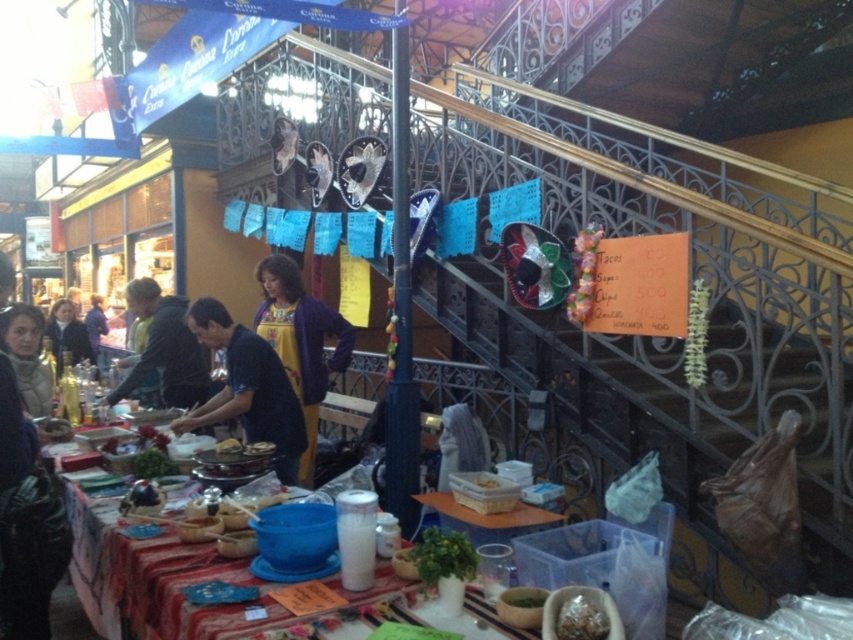
Measure the distance between purple knitwear at center and dark blue sweater at left.

purple knitwear at center and dark blue sweater at left are 14.21 feet apart.

Is purple knitwear at center closer to the viewer compared to dark blue sweater at left?

Yes, purple knitwear at center is in front of dark blue sweater at left.

Who is more distant from viewer, (x=302, y=305) or (x=67, y=348)?

Point (x=67, y=348)

I want to click on purple knitwear at center, so (x=300, y=340).

What do you see at coordinates (67, 333) in the screenshot? The height and width of the screenshot is (640, 853). I see `dark blue sweater at left` at bounding box center [67, 333].

Is point (76, 324) closer to viewer compared to point (485, 488)?

That is False.

Where is `dark blue sweater at left`? The height and width of the screenshot is (640, 853). dark blue sweater at left is located at coordinates (67, 333).

Is point (219, 330) behind point (492, 488)?

Yes, it is.

Is dark blue fabric at center positioned behind white plastic basket at center?

Yes, it is behind white plastic basket at center.

Is point (289, 435) closer to viewer compared to point (473, 477)?

No, (289, 435) is behind (473, 477).

You are a GUI agent. You are given a task and a screenshot of the screen. Output one action in this format:
    pyautogui.click(x=<x>, y=<y>)
    Task: Click on the dark blue fabric at center
    The height and width of the screenshot is (640, 853).
    Given the screenshot: What is the action you would take?
    pyautogui.click(x=247, y=388)